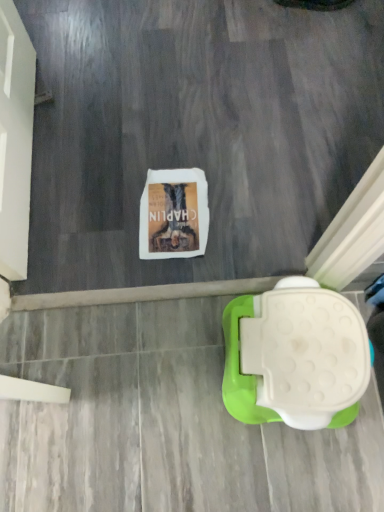
This screenshot has height=512, width=384. What do you see at coordinates (295, 357) in the screenshot?
I see `white plastic toilet at lower right` at bounding box center [295, 357].

Measure the distance between point [278,293] and camera.

Point [278,293] and camera are 39.29 inches apart.

Measure the distance between white plastic toilet at lower right and camera.

The depth of white plastic toilet at lower right is 35.75 inches.

Locate an element on the screen. The image size is (384, 512). white plastic toilet at lower right is located at coordinates (295, 357).

This screenshot has width=384, height=512. Identify the location of white plastic toilet at lower right. (295, 357).